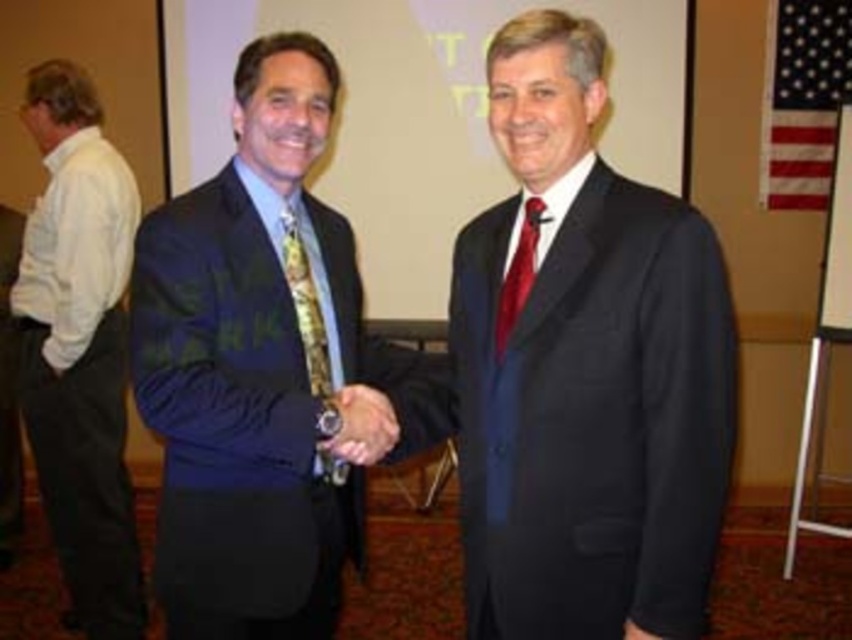
Question: Among these points, which one is farthest from the camera?

Choices:
 (A) (243, 408)
 (B) (10, 540)
 (C) (507, 276)

Answer: (B)

Question: Which is farther from the matte blue suit at center?

Choices:
 (A) matte black suit at left
 (B) matte gold watch at center
 (C) red satin tie at center

Answer: (A)

Question: Is white cotton shirt at left below black leather hand at center?

Choices:
 (A) no
 (B) yes

Answer: (A)

Question: Is matte blue suit at center to the right of black leather hand at center from the viewer's perspective?

Choices:
 (A) no
 (B) yes

Answer: (A)

Question: Which of the following is the farthest from the observer?

Choices:
 (A) (343, 476)
 (B) (508, 296)
 (C) (269, 509)

Answer: (A)

Question: Is white cotton shirt at left above black leather hand at center?

Choices:
 (A) no
 (B) yes

Answer: (B)